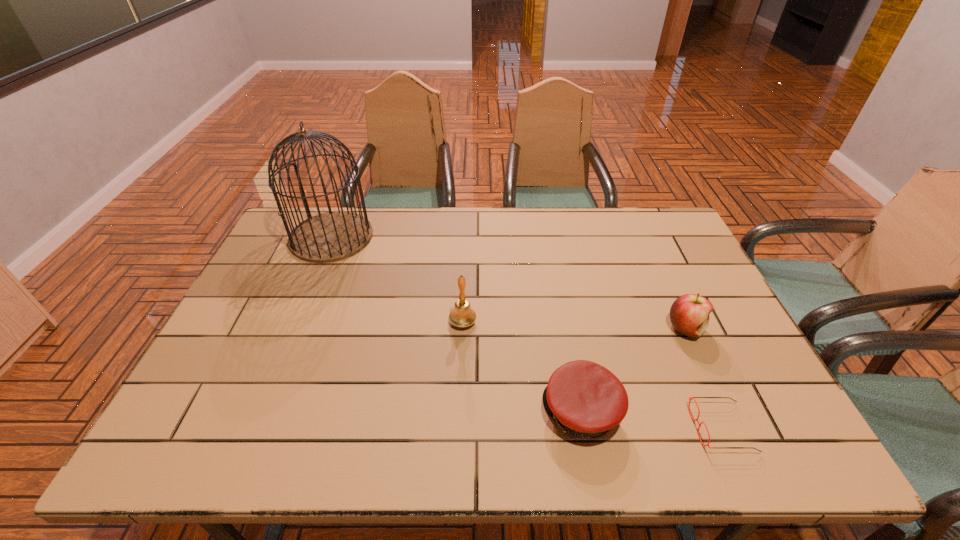
Find the location of a particular element. This screenshot has width=960, height=540. vacant point located between the bell and the cap is located at coordinates (522, 367).

Where is `free space that is in between the birdcage and the third tallest object`? free space that is in between the birdcage and the third tallest object is located at coordinates (509, 282).

Where is `vacant region between the spectacles and the apple`? The width and height of the screenshot is (960, 540). vacant region between the spectacles and the apple is located at coordinates tap(704, 378).

Identify the location of vacant space that's between the leftmost object and the third tallest object. (509, 282).

Find the location of a particular element. The image size is (960, 540). vacant point located between the third shortest object and the cap is located at coordinates (634, 370).

Find the location of a particular element. The height and width of the screenshot is (540, 960). free space between the third object from left to right and the shortest object is located at coordinates tap(652, 420).

Point out which object is positioned as the fourth nearest to the fourth object from right to left. Please provide its 2D coordinates. Your answer should be formatted as a tuple, i.e. [(x, y)], where the tuple contains the x and y coordinates of a point satisfying the conditions above.

[(689, 397)]

You are a GUI agent. You are given a task and a screenshot of the screen. Output one action in this format:
    pyautogui.click(x=<x>, y=<y>)
    Task: Click on the fourth closest object to the bell
    The height and width of the screenshot is (540, 960).
    Given the screenshot: What is the action you would take?
    pyautogui.click(x=689, y=397)

Identify the location of free point that satisfies the following two spatial constraints: 1. at the door of the bell; 2. on the left side of the farthest object. (297, 322).

Where is `blank space that satisfies the following two spatial constraints: 1. at the door of the bell; 2. on the left side of the birdcage`? blank space that satisfies the following two spatial constraints: 1. at the door of the bell; 2. on the left side of the birdcage is located at coordinates (297, 322).